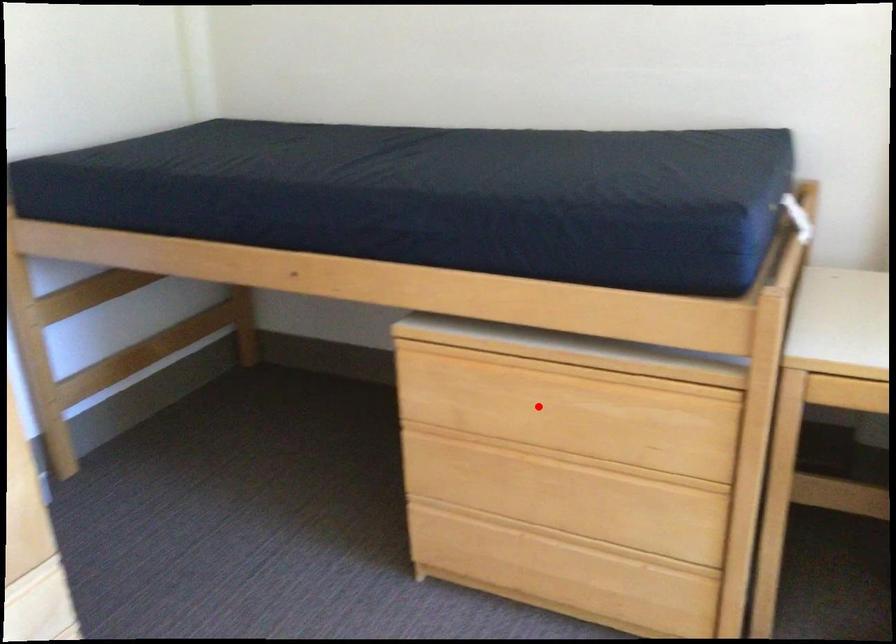
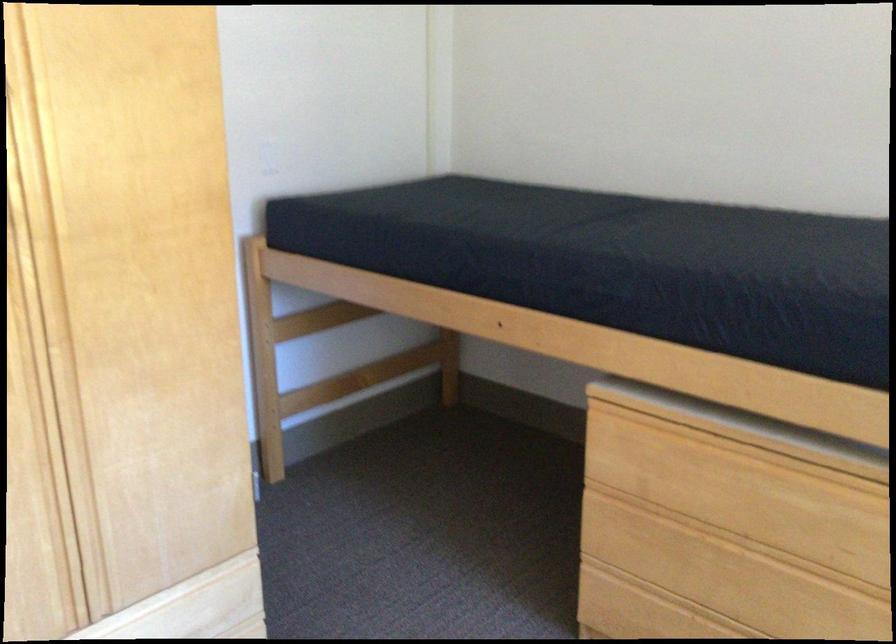
In the second image, find the point that corresponds to the highlighted location in the first image.

(728, 488)